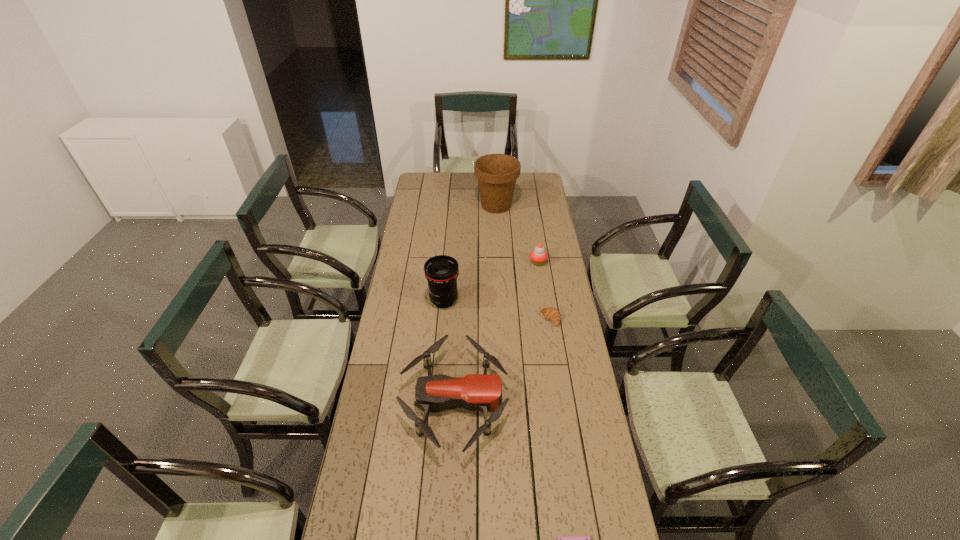
This screenshot has height=540, width=960. In order to click on vacant space situated on the left of the crescent roll in this screenshot , I will do `click(463, 319)`.

Find the location of `object situated at the left edge`. object situated at the left edge is located at coordinates (475, 392).

Locate an element on the screen. The image size is (960, 540). cupcake that is at the right edge is located at coordinates (538, 256).

The image size is (960, 540). In order to click on crescent roll positioned at the right edge in this screenshot , I will do tap(552, 314).

Identify the location of vacant space at the far edge. The width and height of the screenshot is (960, 540). (447, 176).

You are a GUI agent. You are given a task and a screenshot of the screen. Output one action in this format:
    pyautogui.click(x=<x>, y=<y>)
    Task: Click on the vacant space at the left edge
    
    Given the screenshot: What is the action you would take?
    pyautogui.click(x=431, y=217)

Image resolution: width=960 pixels, height=540 pixels. I want to click on free space at the right edge, so click(x=592, y=433).

In the image, there is a desktop. Identify the location of vacant space at the far left corner. The image size is (960, 540). (428, 191).

This screenshot has width=960, height=540. Find the location of `vacant space at the far right corner of the desktop`. vacant space at the far right corner of the desktop is located at coordinates (529, 182).

Locate an element on the screen. Image resolution: width=960 pixels, height=540 pixels. unoccupied area between the cupcake and the farthest object is located at coordinates (517, 234).